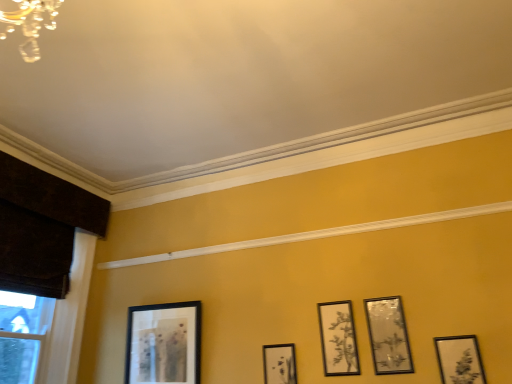
Question: From the image's perspective, is matte black picture frame at lower right, acting as the 1th picture frame starting from the right, under dark brown wood at left?

Choices:
 (A) yes
 (B) no

Answer: (A)

Question: From the image's perspective, is matte black picture frame at lower right, which is counted as the fifth picture frame, starting from the left, over dark brown wood at left?

Choices:
 (A) yes
 (B) no

Answer: (B)

Question: Is matte black picture frame at lower right, acting as the 1th picture frame starting from the right, positioned before dark brown wood at left?

Choices:
 (A) no
 (B) yes

Answer: (B)

Question: Is matte black picture frame at lower right, acting as the 1th picture frame starting from the right, taller than dark brown wood at left?

Choices:
 (A) no
 (B) yes

Answer: (A)

Question: Does matte black picture frame at lower right, acting as the 1th picture frame starting from the right, have a larger size compared to dark brown wood at left?

Choices:
 (A) yes
 (B) no

Answer: (B)

Question: Could you tell me if matte black picture frame at lower right, acting as the 1th picture frame starting from the right, is turned towards dark brown wood at left?

Choices:
 (A) yes
 (B) no

Answer: (B)

Question: Does matte black picture frame at lower right, which is counted as the fifth picture frame, starting from the left, turn towards matte black picture frame at center, which is counted as the 3th picture frame, starting from the left?

Choices:
 (A) yes
 (B) no

Answer: (B)

Question: From the image's perspective, does matte black picture frame at lower right, acting as the 1th picture frame starting from the right, appear higher than matte black picture frame at center, which is counted as the 3th picture frame, starting from the left?

Choices:
 (A) yes
 (B) no

Answer: (B)

Question: Is matte black picture frame at lower right, acting as the 1th picture frame starting from the right, far from matte black picture frame at center, acting as the 3th picture frame starting from the right?

Choices:
 (A) no
 (B) yes

Answer: (A)

Question: From a real-world perspective, does matte black picture frame at lower right, acting as the 1th picture frame starting from the right, sit lower than matte black picture frame at center, acting as the 3th picture frame starting from the right?

Choices:
 (A) no
 (B) yes

Answer: (B)

Question: Considering the relative positions of matte black picture frame at lower right, which is counted as the fifth picture frame, starting from the left, and matte black picture frame at center, which is counted as the 3th picture frame, starting from the left, in the image provided, is matte black picture frame at lower right, which is counted as the fifth picture frame, starting from the left, to the right of matte black picture frame at center, which is counted as the 3th picture frame, starting from the left, from the viewer's perspective?

Choices:
 (A) no
 (B) yes

Answer: (B)

Question: Does matte black picture frame at lower right, which is counted as the fifth picture frame, starting from the left, have a larger size compared to matte black picture frame at center, which is counted as the 3th picture frame, starting from the left?

Choices:
 (A) yes
 (B) no

Answer: (B)

Question: Is matte black picture frame at center, which appears as the second picture frame when viewed from the left, at the left side of matte black picture frame at center, acting as the 3th picture frame starting from the right?

Choices:
 (A) no
 (B) yes

Answer: (B)